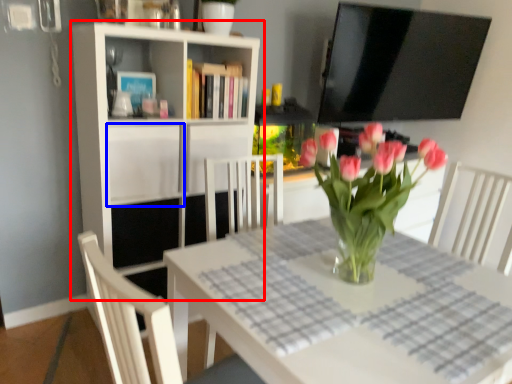
Question: Among these objects, which one is farthest to the camera, shelf (highlighted by a red box) or cabinet (highlighted by a blue box)?

Choices:
 (A) shelf
 (B) cabinet

Answer: (B)